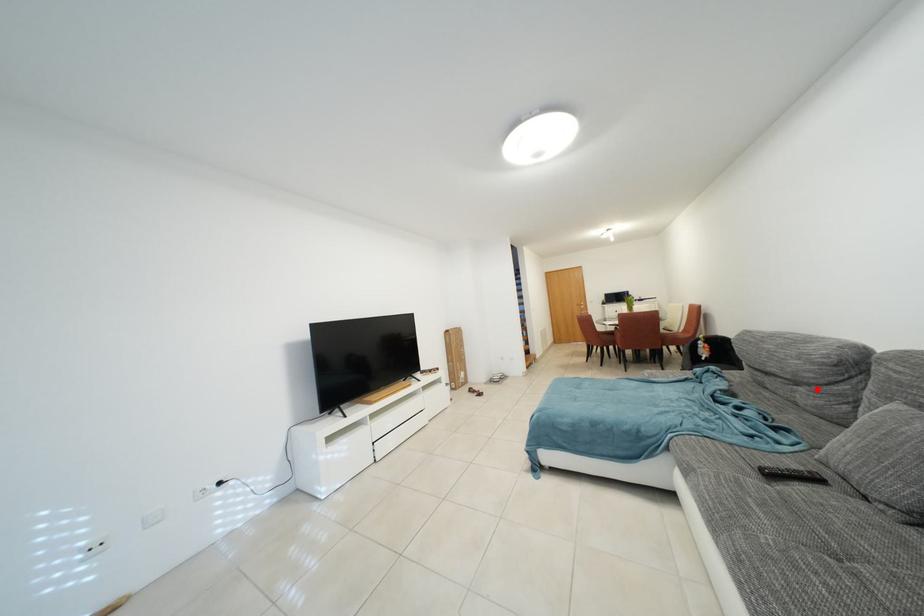
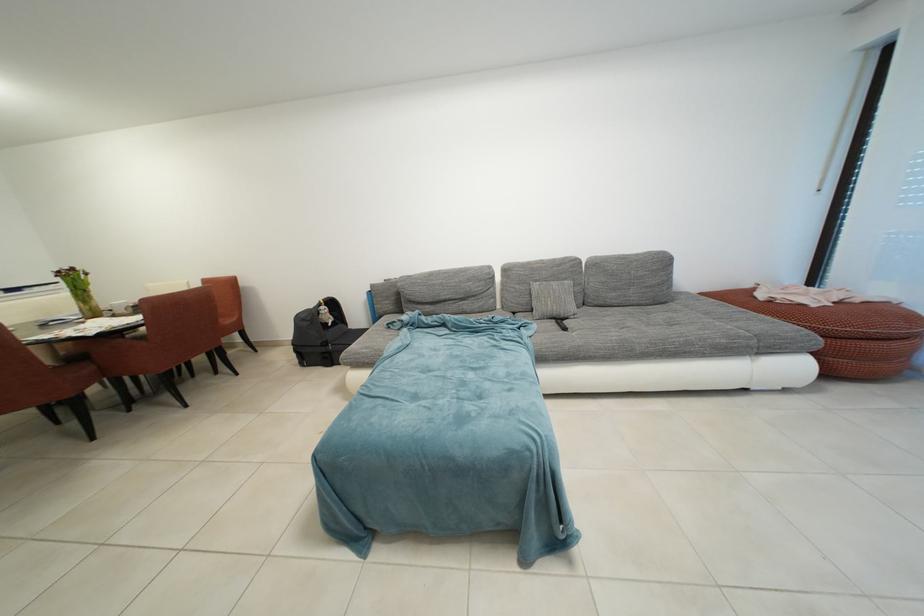
Find the pixel in the second image that matches the highlighted location in the first image.

(482, 301)